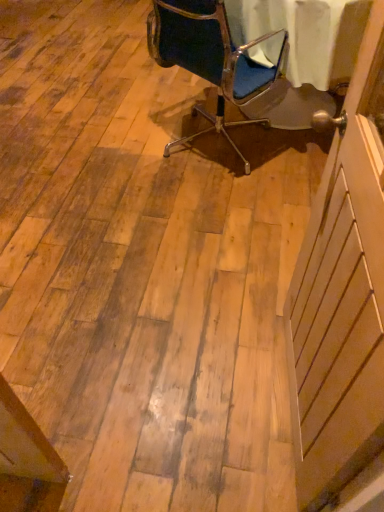
Image resolution: width=384 pixels, height=512 pixels. I want to click on free region on the left part of blue fabric chair at upper center, so click(x=110, y=146).